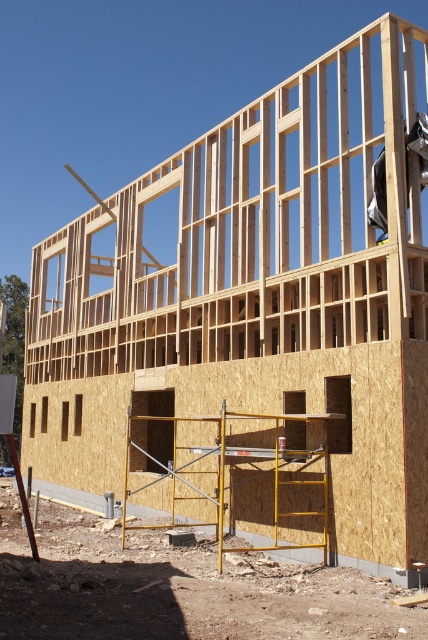
Question: Which point is farther to the camera?

Choices:
 (A) yellow metal scaffolding at lower center
 (B) dark gray fabric construction worker at upper right

Answer: (B)

Question: Which object appears closest to the camera in this image?

Choices:
 (A) yellow metal scaffolding at lower center
 (B) dark gray fabric construction worker at upper right

Answer: (A)

Question: Does yellow metal scaffolding at lower center appear under dark gray fabric construction worker at upper right?

Choices:
 (A) yes
 (B) no

Answer: (A)

Question: Can you confirm if yellow metal scaffolding at lower center is positioned below dark gray fabric construction worker at upper right?

Choices:
 (A) yes
 (B) no

Answer: (A)

Question: Does yellow metal scaffolding at lower center have a smaller size compared to dark gray fabric construction worker at upper right?

Choices:
 (A) yes
 (B) no

Answer: (B)